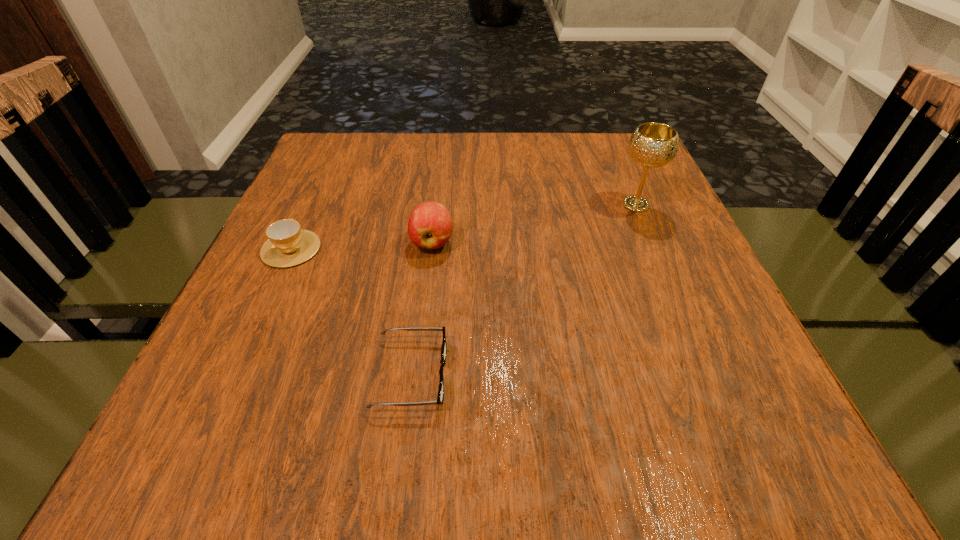
At what (x,y) coordinates should I click in order to perform the action: click on vacant space that is in between the cup and the nearest object. Please return your answer as a coordinate pair (x, y). The image size is (960, 540). Looking at the image, I should click on (351, 312).

Locate an element on the screen. The image size is (960, 540). free point between the farthest object and the apple is located at coordinates (534, 223).

Identify which object is located as the third nearest to the second shortest object. Please provide its 2D coordinates. Your answer should be formatted as a tuple, i.e. [(x, y)], where the tuple contains the x and y coordinates of a point satisfying the conditions above.

[(652, 145)]

Point out which object is positioned as the second nearest to the chalice. Please provide its 2D coordinates. Your answer should be formatted as a tuple, i.e. [(x, y)], where the tuple contains the x and y coordinates of a point satisfying the conditions above.

[(440, 397)]

The image size is (960, 540). In order to click on free space in the image that satisfies the following two spatial constraints: 1. with the handle on the side of the third shortest object; 2. on the right side of the leftmost object in this screenshot , I will do `click(294, 242)`.

The image size is (960, 540). What are the coordinates of `vacant space that satisfies the following two spatial constraints: 1. on the front side of the third shortest object; 2. on the front-facing side of the spectacles` in the screenshot? It's located at (417, 374).

Identify the location of vacant position in the image that satisfies the following two spatial constraints: 1. on the front side of the apple; 2. on the front-facing side of the nearest object. The width and height of the screenshot is (960, 540). (417, 374).

Locate an element on the screen. The width and height of the screenshot is (960, 540). blank space that satisfies the following two spatial constraints: 1. on the front side of the tallest object; 2. on the front-facing side of the spectacles is located at coordinates click(708, 374).

Find the location of a particular element. Image resolution: width=960 pixels, height=540 pixels. vacant space that satisfies the following two spatial constraints: 1. with the handle on the side of the cup; 2. on the right side of the third shortest object is located at coordinates (294, 242).

Where is `vacant space that satisfies the following two spatial constraints: 1. with the handle on the side of the cup; 2. on the left side of the apple`? The width and height of the screenshot is (960, 540). vacant space that satisfies the following two spatial constraints: 1. with the handle on the side of the cup; 2. on the left side of the apple is located at coordinates (294, 242).